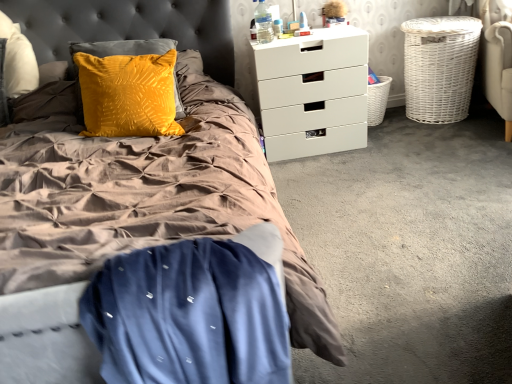
Question: Is velvet yellow pillow at upper left shorter than white wicker basket at right, positioned as the first basket in right-to-left order?

Choices:
 (A) no
 (B) yes

Answer: (B)

Question: Can you confirm if velvet yellow pillow at upper left is positioned to the left of white wicker basket at right, which appears as the second basket when viewed from the left?

Choices:
 (A) no
 (B) yes

Answer: (B)

Question: Are velvet yellow pillow at upper left and white wicker basket at right, which appears as the second basket when viewed from the left, located far from each other?

Choices:
 (A) no
 (B) yes

Answer: (B)

Question: Would you say white wicker basket at right, which appears as the second basket when viewed from the left, is part of velvet yellow pillow at upper left's contents?

Choices:
 (A) no
 (B) yes

Answer: (A)

Question: From the image's perspective, would you say velvet yellow pillow at upper left is positioned over white wicker basket at right, positioned as the first basket in right-to-left order?

Choices:
 (A) no
 (B) yes

Answer: (A)

Question: Is velvet yellow pillow at upper left thinner than white wicker basket at right, positioned as the first basket in right-to-left order?

Choices:
 (A) yes
 (B) no

Answer: (A)

Question: Can you confirm if white matte chest of drawers at upper right is positioned to the right of blue satin blanket at lower left?

Choices:
 (A) yes
 (B) no

Answer: (A)

Question: Does white matte chest of drawers at upper right turn towards blue satin blanket at lower left?

Choices:
 (A) yes
 (B) no

Answer: (A)

Question: Is white matte chest of drawers at upper right positioned with its back to blue satin blanket at lower left?

Choices:
 (A) yes
 (B) no

Answer: (B)

Question: Does white matte chest of drawers at upper right appear on the left side of blue satin blanket at lower left?

Choices:
 (A) no
 (B) yes

Answer: (A)

Question: Can you confirm if white matte chest of drawers at upper right is bigger than blue satin blanket at lower left?

Choices:
 (A) yes
 (B) no

Answer: (A)

Question: From the image's perspective, is white matte chest of drawers at upper right located beneath blue satin blanket at lower left?

Choices:
 (A) yes
 (B) no

Answer: (B)

Question: Does white wicker basket at right, which appears as the second basket when viewed from the left, come behind blue satin blanket at lower left?

Choices:
 (A) no
 (B) yes

Answer: (B)